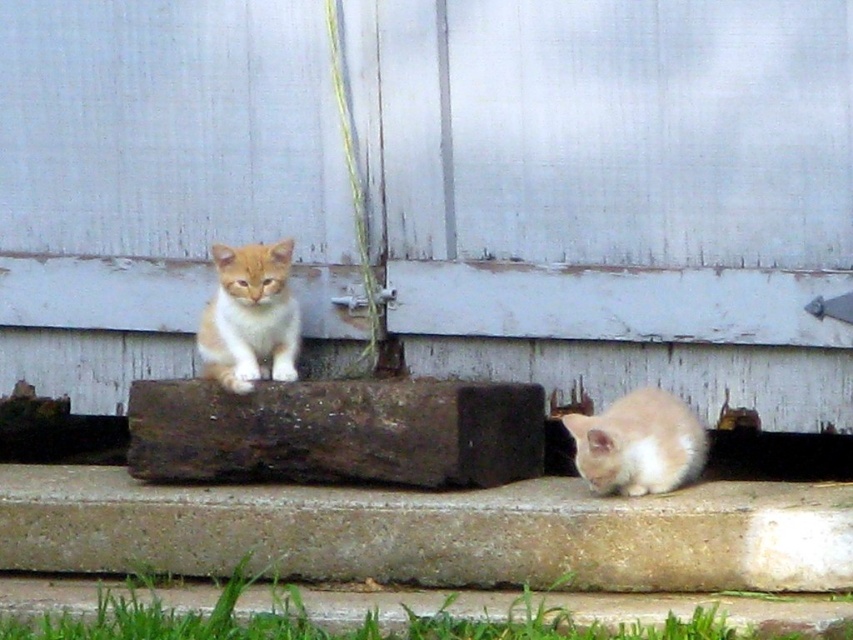
Question: Which object appears closest to the camera in this image?

Choices:
 (A) orange fur kitten at center
 (B) soft orange fur at lower right

Answer: (B)

Question: Observing the image, what is the correct spatial positioning of orange fur kitten at center in reference to soft orange fur at lower right?

Choices:
 (A) above
 (B) below

Answer: (A)

Question: Which object appears closest to the camera in this image?

Choices:
 (A) soft orange fur at lower right
 (B) orange fur kitten at center

Answer: (A)

Question: Is orange fur kitten at center wider than soft orange fur at lower right?

Choices:
 (A) no
 (B) yes

Answer: (A)

Question: Can you confirm if orange fur kitten at center is positioned below soft orange fur at lower right?

Choices:
 (A) no
 (B) yes

Answer: (A)

Question: Among these objects, which one is nearest to the camera?

Choices:
 (A) soft orange fur at lower right
 (B) orange fur kitten at center

Answer: (A)